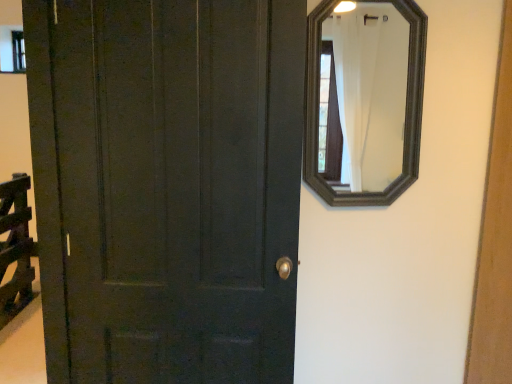
Question: Is matte dark green door at left placed right next to black wooden mirror at upper right?

Choices:
 (A) no
 (B) yes

Answer: (A)

Question: Can you confirm if matte dark green door at left is wider than black wooden mirror at upper right?

Choices:
 (A) yes
 (B) no

Answer: (A)

Question: Is matte dark green door at left bigger than black wooden mirror at upper right?

Choices:
 (A) no
 (B) yes

Answer: (B)

Question: Is the position of matte dark green door at left less distant than that of black wooden mirror at upper right?

Choices:
 (A) yes
 (B) no

Answer: (A)

Question: Considering the relative sizes of matte dark green door at left and black wooden mirror at upper right in the image provided, is matte dark green door at left thinner than black wooden mirror at upper right?

Choices:
 (A) no
 (B) yes

Answer: (A)

Question: Is matte dark green door at left bigger or smaller than transparent glass window at upper left?

Choices:
 (A) big
 (B) small

Answer: (A)

Question: From their relative heights in the image, would you say matte dark green door at left is taller or shorter than transparent glass window at upper left?

Choices:
 (A) tall
 (B) short

Answer: (A)

Question: Do you think matte dark green door at left is within transparent glass window at upper left, or outside of it?

Choices:
 (A) outside
 (B) inside

Answer: (A)

Question: Considering the positions of point (297, 48) and point (17, 69), is point (297, 48) closer or farther from the camera than point (17, 69)?

Choices:
 (A) farther
 (B) closer

Answer: (B)

Question: In the image, is transparent glass window at upper left positioned in front of or behind black wooden mirror at upper right?

Choices:
 (A) front
 (B) behind

Answer: (B)

Question: Considering the positions of transparent glass window at upper left and black wooden mirror at upper right in the image, is transparent glass window at upper left taller or shorter than black wooden mirror at upper right?

Choices:
 (A) tall
 (B) short

Answer: (B)

Question: Is transparent glass window at upper left wider or thinner than black wooden mirror at upper right?

Choices:
 (A) wide
 (B) thin

Answer: (B)

Question: Is point (5, 51) closer or farther from the camera than point (385, 44)?

Choices:
 (A) farther
 (B) closer

Answer: (B)

Question: Considering the relative positions of transparent glass window at upper left and matte dark green door at left in the image provided, is transparent glass window at upper left to the left or to the right of matte dark green door at left?

Choices:
 (A) right
 (B) left

Answer: (B)

Question: Do you think transparent glass window at upper left is within matte dark green door at left, or outside of it?

Choices:
 (A) outside
 (B) inside

Answer: (A)